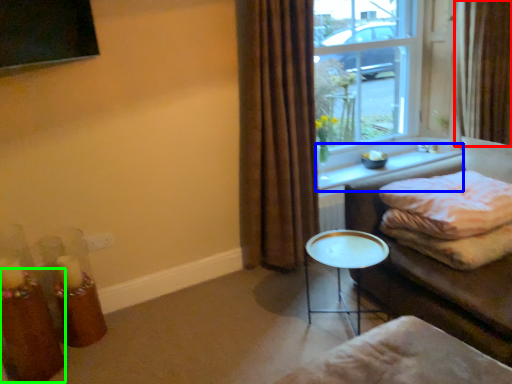
Question: Based on their relative distances, which object is nearer to curtain (highlighted by a red box)? Choose from window sill (highlighted by a blue box) and candle holder (highlighted by a green box).

Choices:
 (A) window sill
 (B) candle holder

Answer: (A)